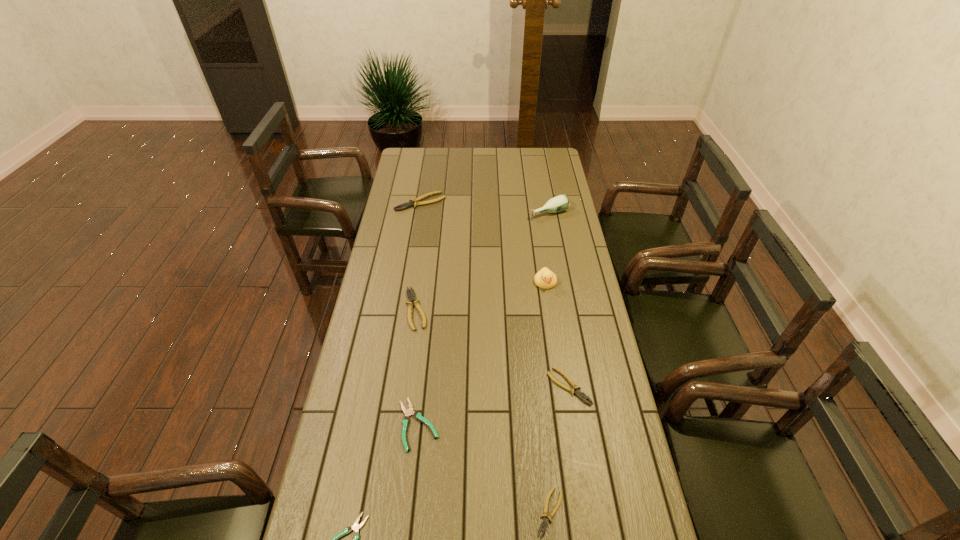
The width and height of the screenshot is (960, 540). What are the coordinates of `vacant area that lies between the second biggest yellow pliers and the bigger teal pliers` in the screenshot? It's located at (418, 367).

Locate an element on the screen. This screenshot has width=960, height=540. vacant space that's between the nearest yellow pliers and the fourth shortest pliers is located at coordinates (560, 449).

Locate which object ranks fifth in proximity to the bigger teal pliers. Please provide its 2D coordinates. Your answer should be formatted as a tuple, i.e. [(x, y)], where the tuple contains the x and y coordinates of a point satisfying the conditions above.

[(545, 279)]

The height and width of the screenshot is (540, 960). What are the coordinates of `object identified as the seventh closest to the second nearest yellow pliers` in the screenshot? It's located at (413, 202).

Locate which pliers is the fifth closest to the bottle. Please provide its 2D coordinates. Your answer should be formatted as a tuple, i.e. [(x, y)], where the tuple contains the x and y coordinates of a point satisfying the conditions above.

[(545, 522)]

Locate which pliers is the fourth closest to the nearer teal pliers. Please provide its 2D coordinates. Your answer should be formatted as a tuple, i.e. [(x, y)], where the tuple contains the x and y coordinates of a point satisfying the conditions above.

[(411, 297)]

Where is `yellow pliers that stands as the second closest to the right teal pliers`? This screenshot has width=960, height=540. yellow pliers that stands as the second closest to the right teal pliers is located at coordinates (545, 522).

Select which yellow pliers appears as the third closest to the shortest pliers. Please provide its 2D coordinates. Your answer should be formatted as a tuple, i.e. [(x, y)], where the tuple contains the x and y coordinates of a point satisfying the conditions above.

[(411, 297)]

What are the coordinates of `free region that satisfies the following two spatial constraints: 1. on the front side of the farther teal pliers; 2. on the right side of the second tallest pliers` in the screenshot? It's located at (400, 425).

Locate an element on the screen. This screenshot has height=540, width=960. free location that satisfies the following two spatial constraints: 1. on the front side of the nearest yellow pliers; 2. on the left side of the second biggest yellow pliers is located at coordinates (389, 512).